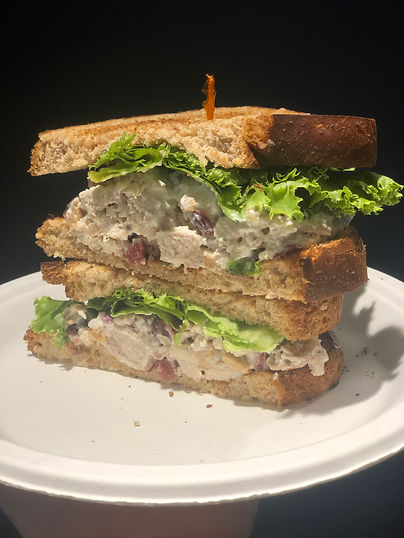
This screenshot has height=538, width=404. Find the location of `inside part of white plate`. inside part of white plate is located at coordinates (62, 404), (208, 422).